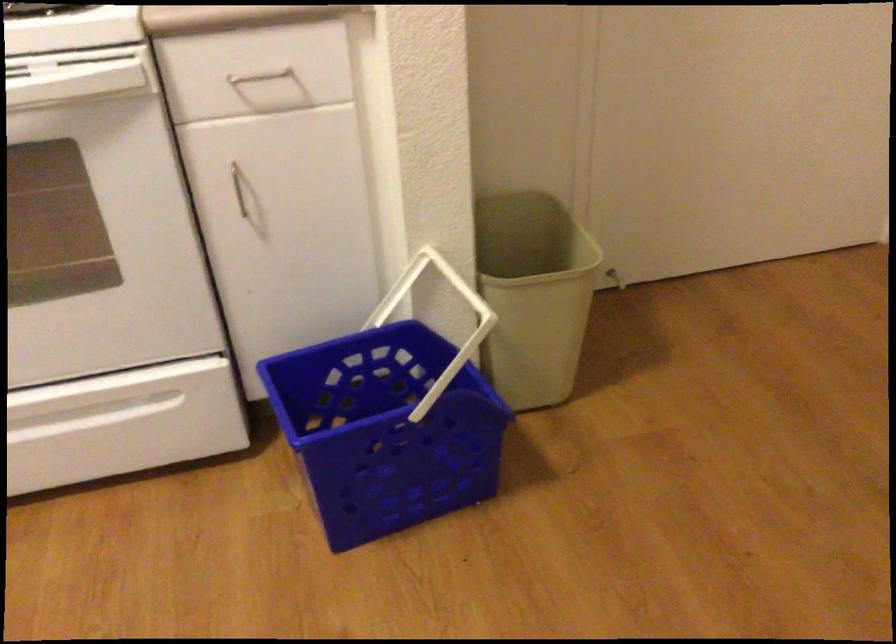
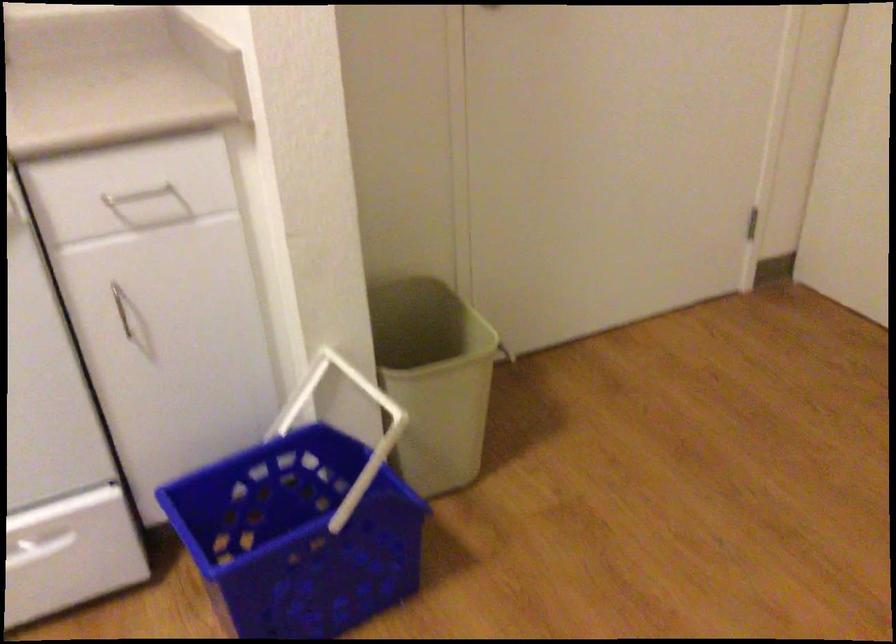
Looking at this image, which direction would the cameraman need to move to produce the second image?

The movement direction of the cameraman is left, forward.